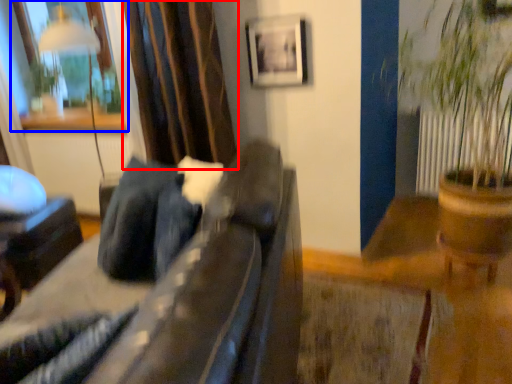
Question: Which of the following is the closest to the observer, curtain (highlighted by a red box) or window (highlighted by a blue box)?

Choices:
 (A) curtain
 (B) window

Answer: (A)